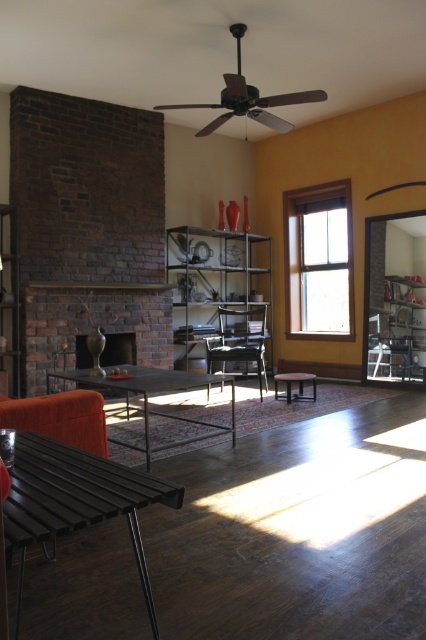
Question: Does brick fireplace at center have a lesser width compared to metallic silver chair at right?

Choices:
 (A) yes
 (B) no

Answer: (B)

Question: Based on their relative distances, which object is nearer to the brick fireplace at center?

Choices:
 (A) metal/textured coffee table at center
 (B) black metal bench at lower left
 (C) metallic silver chair at right

Answer: (A)

Question: Which of the following is the farthest from the observer?

Choices:
 (A) (134, 291)
 (B) (14, 538)
 (C) (288, 396)

Answer: (A)

Question: Which object is the farthest from the matte brown vase at left?

Choices:
 (A) brick fireplace at center
 (B) wooden stool at center
 (C) black metal bench at lower left
 (D) metallic black armchair at center

Answer: (C)

Question: Is metallic silver chair at right to the left of matte brown vase at left from the viewer's perspective?

Choices:
 (A) yes
 (B) no

Answer: (B)

Question: Can you confirm if clear glass window at center is bigger than metal/textured coffee table at center?

Choices:
 (A) no
 (B) yes

Answer: (A)